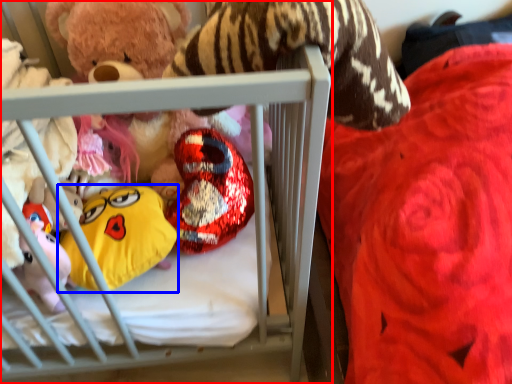
Question: Which object appears closest to the camera in this image, infant bed (highlighted by a red box) or toy (highlighted by a blue box)?

Choices:
 (A) infant bed
 (B) toy

Answer: (A)